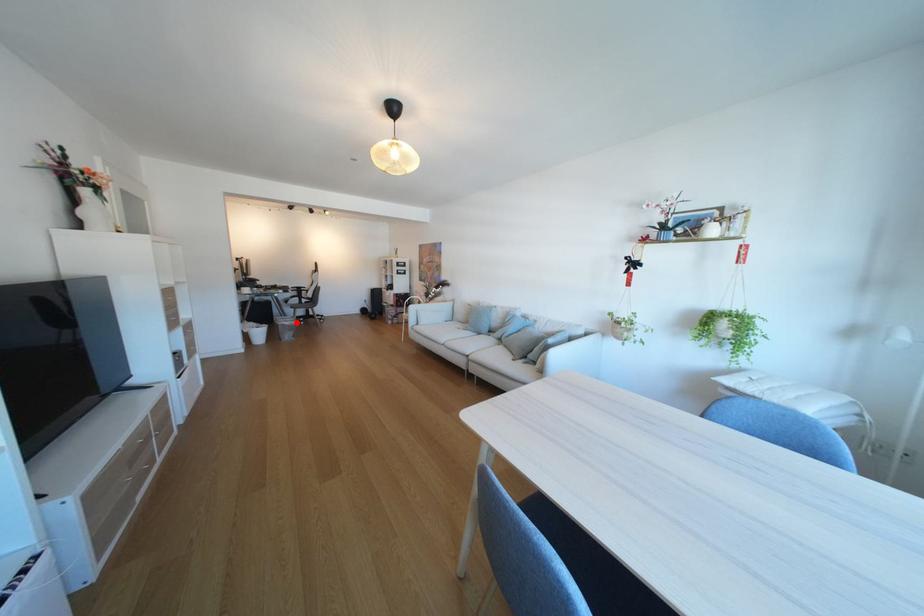
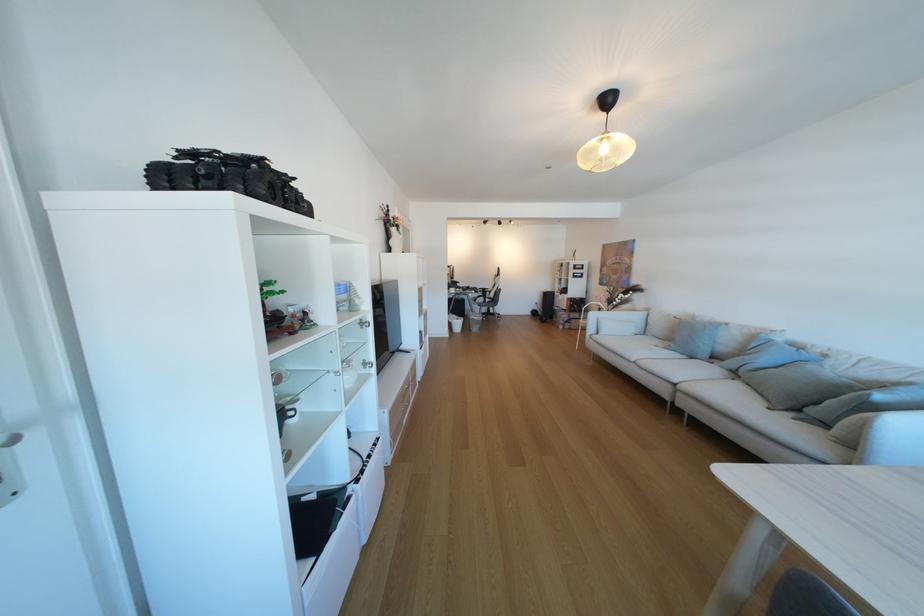
The point at the highlighted location is marked in the first image. Where is the corresponding point in the second image?

(485, 317)